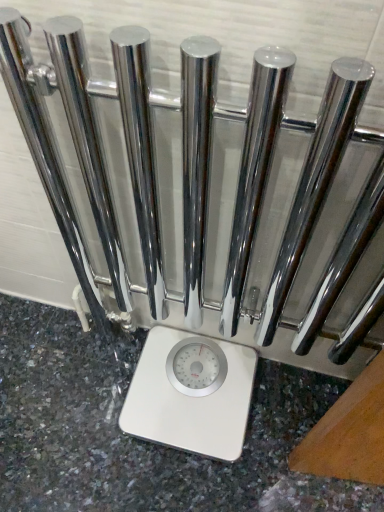
The image size is (384, 512). I want to click on vacant space in front of white glossy scale at center, so click(x=180, y=479).